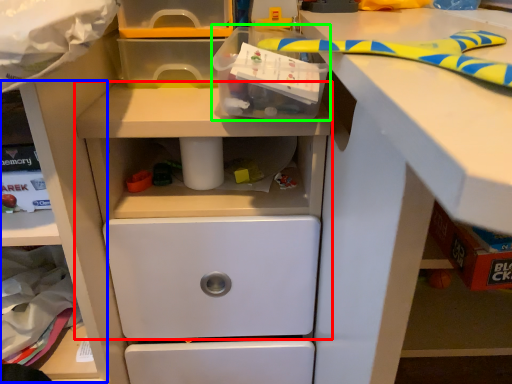
Question: Which object is positioned farthest from workbench (highlighted by a red box)? Select from shelf (highlighted by a blue box) and box (highlighted by a green box).

Choices:
 (A) shelf
 (B) box

Answer: (B)